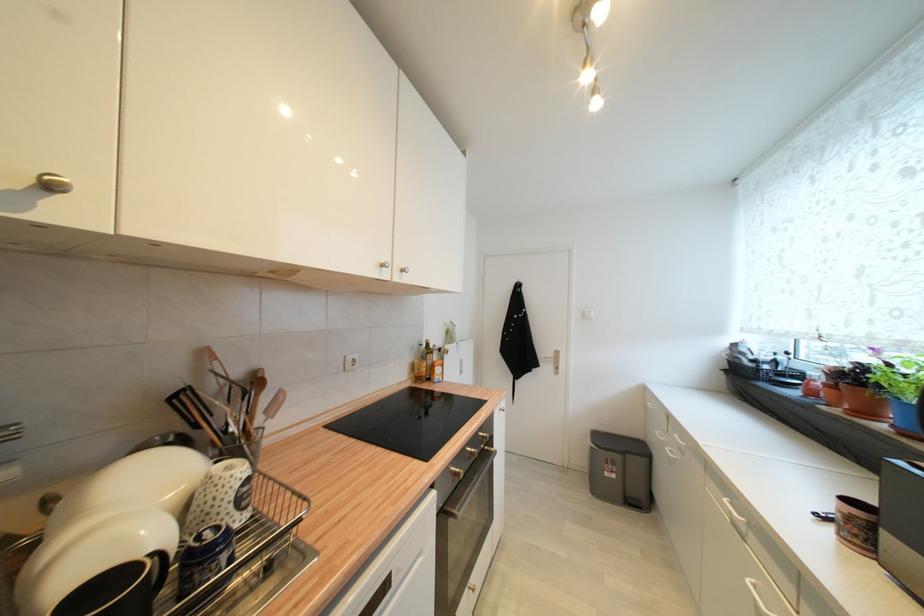
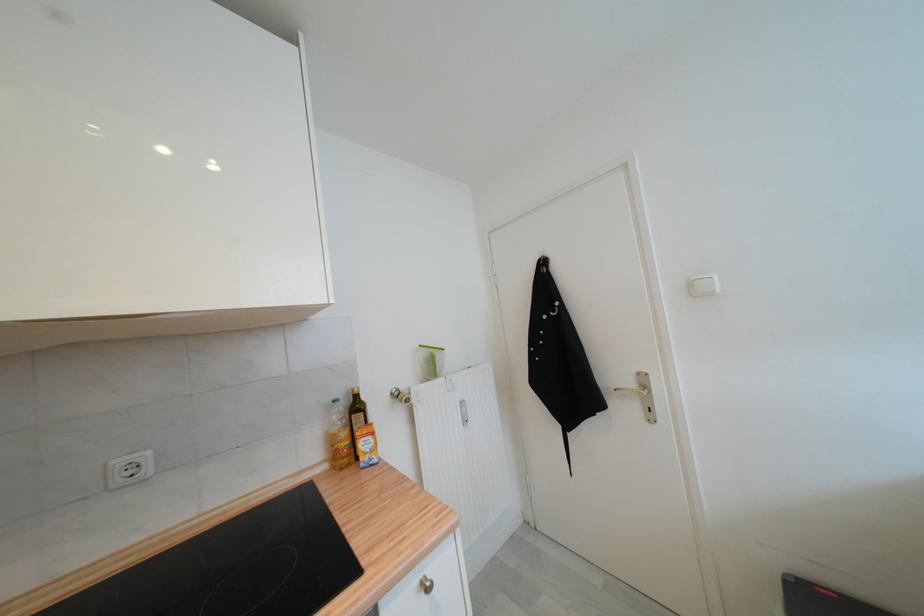
In the second image, find the point that corresponds to [355,359] in the first image.

(126, 464)